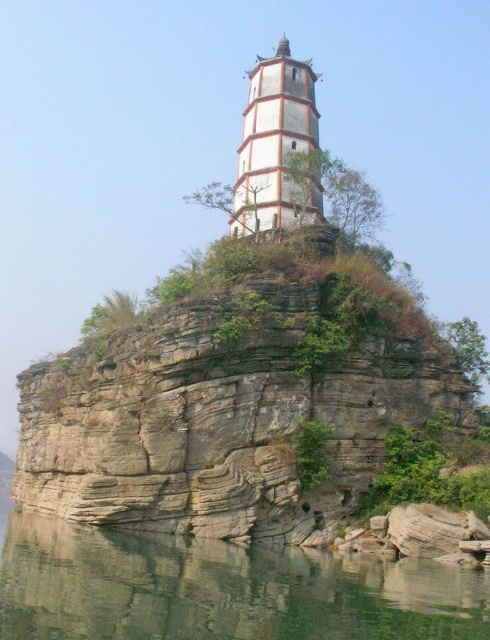
Question: Which object is closer to the camera taking this photo?

Choices:
 (A) clear water at lower center
 (B) white striped tower at center

Answer: (A)

Question: Is the position of clear water at lower center more distant than that of white striped tower at center?

Choices:
 (A) yes
 (B) no

Answer: (B)

Question: Does clear water at lower center have a greater width compared to white striped tower at center?

Choices:
 (A) no
 (B) yes

Answer: (B)

Question: Is clear water at lower center above white striped tower at center?

Choices:
 (A) yes
 (B) no

Answer: (B)